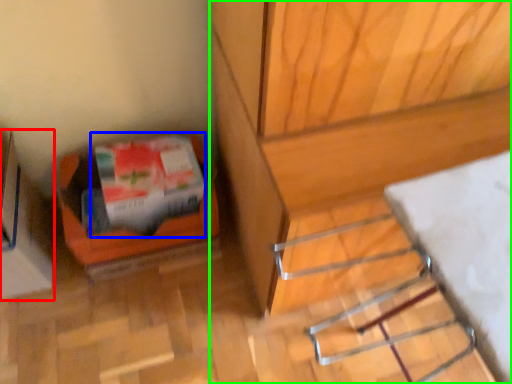
Question: Which object is positioned closest to cardboard box (highlighted by a red box)? Select from wrapping paper (highlighted by a blue box) and furniture (highlighted by a green box).

Choices:
 (A) wrapping paper
 (B) furniture

Answer: (A)